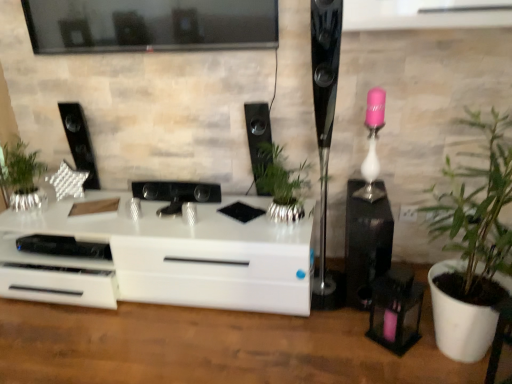
You are a GUI agent. You are given a task and a screenshot of the screen. Output one action in this format:
    pyautogui.click(x=<x>, y=<y>)
    Task: Click on the vacant area that lies between polished black speaker at right, the third speaker viewed from the left, and black glossy speaker at right, which ranks as the 4th speaker in left-to-right order
    
    Given the screenshot: What is the action you would take?
    pyautogui.click(x=329, y=268)